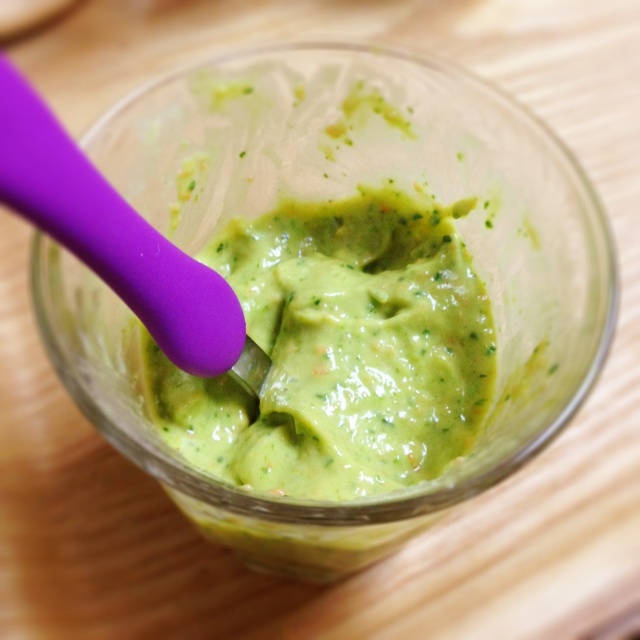
You are at a party and want to serve guacamole from the bowl. The bowl has a capacity of 500 ml. If the green creamy guacamole at center currently occupies 700 ml, can you fit the purple silicone spoon at center into the bowl without spilling any guacamole?

The green creamy guacamole at center is bigger than the purple silicone spoon at center. Since the guacamole already occupies 700 ml, which exceeds the bowl capacity of 500 ml, the spoon cannot be added without causing overflow.

You are preparing to serve guacamole and need to know if the purple silicone spoon at center can fully submerge into the green creamy guacamole at center. Based on the scene, can it?

The green creamy guacamole at center is taller than the purple silicone spoon at center, so the spoon can fully submerge into the guacamole.